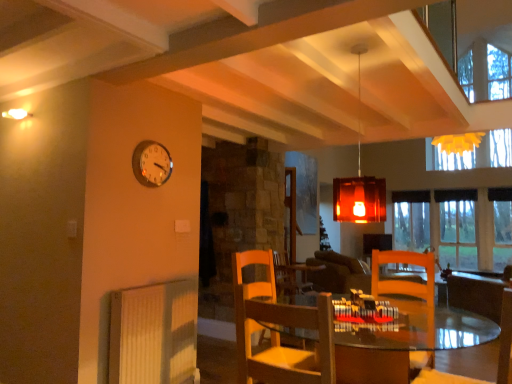
Question: Is wooden chair at lower right, acting as the 1th chair starting from the right, far from white ribbed radiator at lower left?

Choices:
 (A) no
 (B) yes

Answer: (B)

Question: Considering the relative sizes of wooden chair at lower right, acting as the 1th chair starting from the right, and white ribbed radiator at lower left in the image provided, is wooden chair at lower right, acting as the 1th chair starting from the right, shorter than white ribbed radiator at lower left?

Choices:
 (A) yes
 (B) no

Answer: (A)

Question: From the image's perspective, is wooden chair at lower right, acting as the 1th chair starting from the right, beneath white ribbed radiator at lower left?

Choices:
 (A) no
 (B) yes

Answer: (A)

Question: Can we say wooden chair at lower right, acting as the second chair starting from the left, lies outside white ribbed radiator at lower left?

Choices:
 (A) no
 (B) yes

Answer: (B)

Question: Is white ribbed radiator at lower left at the back of wooden chair at lower right, acting as the second chair starting from the left?

Choices:
 (A) no
 (B) yes

Answer: (A)

Question: From the image's perspective, is white glossy clock at upper left positioned above or below white ribbed radiator at lower left?

Choices:
 (A) above
 (B) below

Answer: (A)

Question: Considering the positions of white glossy clock at upper left and white ribbed radiator at lower left in the image, is white glossy clock at upper left bigger or smaller than white ribbed radiator at lower left?

Choices:
 (A) small
 (B) big

Answer: (A)

Question: From a real-world perspective, is white glossy clock at upper left positioned above or below white ribbed radiator at lower left?

Choices:
 (A) below
 (B) above

Answer: (B)

Question: Do you think white glossy clock at upper left is within white ribbed radiator at lower left, or outside of it?

Choices:
 (A) inside
 (B) outside

Answer: (B)

Question: From a real-world perspective, is clear glass window at center above or below white ribbed radiator at lower left?

Choices:
 (A) below
 (B) above

Answer: (B)

Question: Is clear glass window at center bigger or smaller than white ribbed radiator at lower left?

Choices:
 (A) big
 (B) small

Answer: (A)

Question: Considering the positions of clear glass window at center and white ribbed radiator at lower left in the image, is clear glass window at center taller or shorter than white ribbed radiator at lower left?

Choices:
 (A) tall
 (B) short

Answer: (A)

Question: Is clear glass window at center situated inside white ribbed radiator at lower left or outside?

Choices:
 (A) outside
 (B) inside

Answer: (A)

Question: Considering their positions, is wooden chair at lower right, acting as the 1th chair starting from the right, located in front of or behind wooden chair at center, the first chair positioned from the left?

Choices:
 (A) behind
 (B) front

Answer: (A)

Question: Looking at the image, does wooden chair at lower right, acting as the 1th chair starting from the right, seem bigger or smaller compared to wooden chair at center, the 2th chair positioned from the right?

Choices:
 (A) small
 (B) big

Answer: (B)